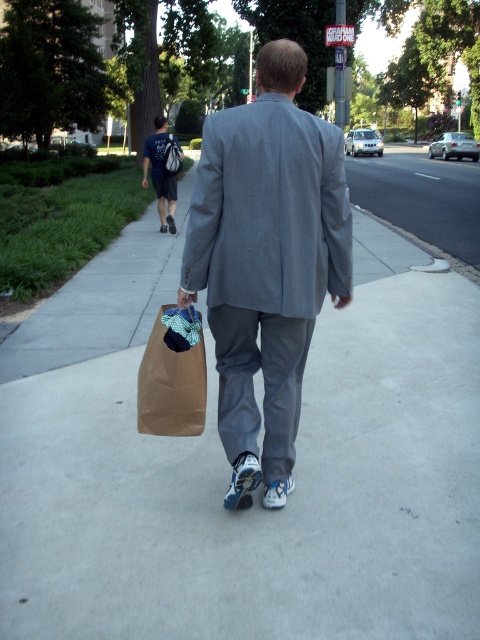
Question: Is gray wool suit at center smaller than dark blue t-shirt at upper left?

Choices:
 (A) yes
 (B) no

Answer: (A)

Question: Which point is closer to the camera?

Choices:
 (A) (156, 140)
 (B) (156, 417)

Answer: (B)

Question: Which object is the closest to the brown paper bag at center?

Choices:
 (A) gray wool suit at center
 (B) dark blue t-shirt at upper left

Answer: (A)

Question: Which object is farther from the camera taking this photo?

Choices:
 (A) gray wool suit at center
 (B) dark blue t-shirt at upper left
 (C) brown paper bag at center

Answer: (B)

Question: Can you confirm if brown paper bag at center is positioned to the left of dark blue t-shirt at upper left?

Choices:
 (A) no
 (B) yes

Answer: (A)

Question: Considering the relative positions of gray wool suit at center and brown paper bag at center in the image provided, where is gray wool suit at center located with respect to brown paper bag at center?

Choices:
 (A) right
 (B) left

Answer: (A)